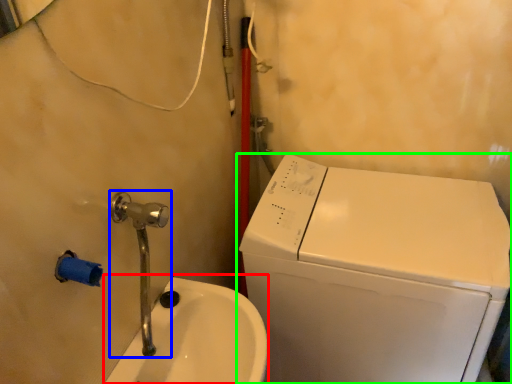
Question: Estimate the real-world distances between objects in this image. Which object is farther from sink (highlighted by a red box), plumbing fixture (highlighted by a blue box) or washing machine (highlighted by a green box)?

Choices:
 (A) plumbing fixture
 (B) washing machine

Answer: (B)